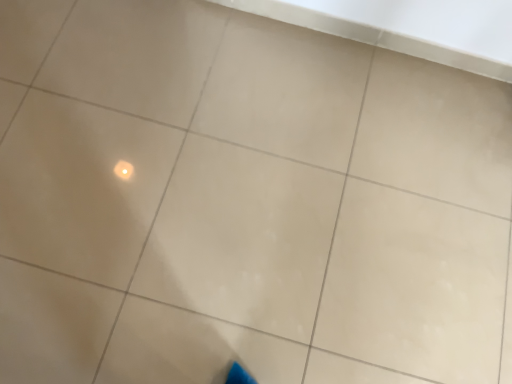
Find the location of a particular element. The height and width of the screenshot is (384, 512). vacant region to the left of white glossy bathtub at upper right is located at coordinates (166, 66).